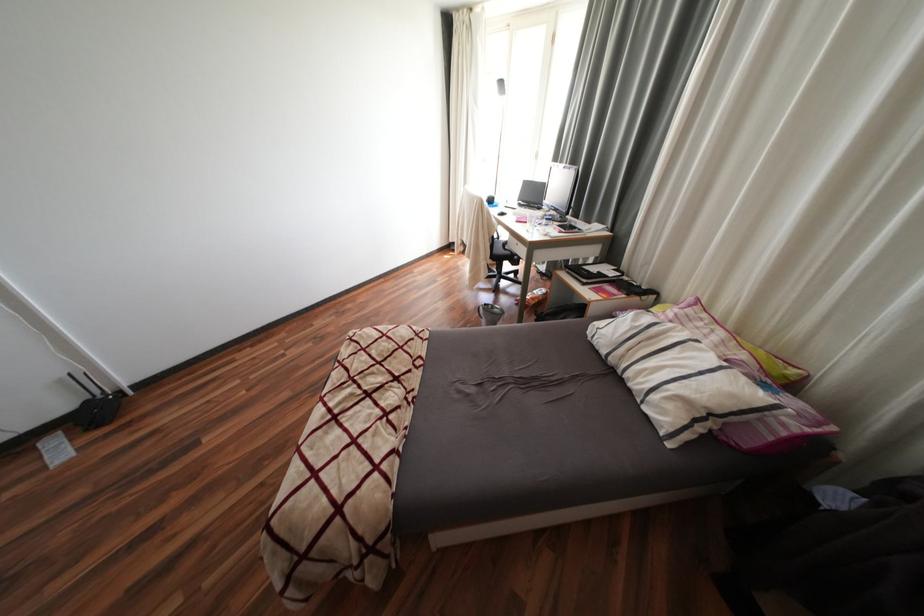
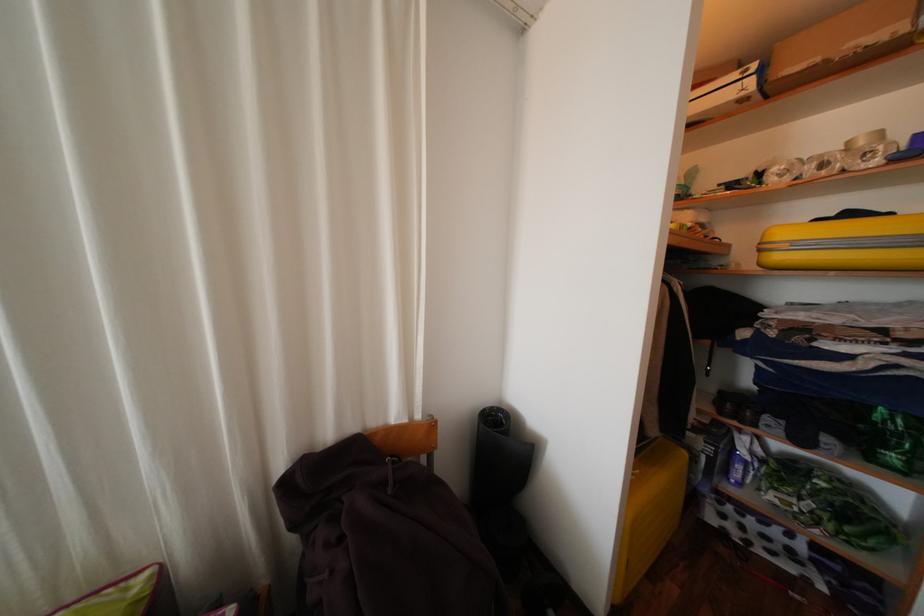
The images are taken continuously from a first-person perspective. In which direction is your viewpoint rotating?

The camera rotated toward right-down.